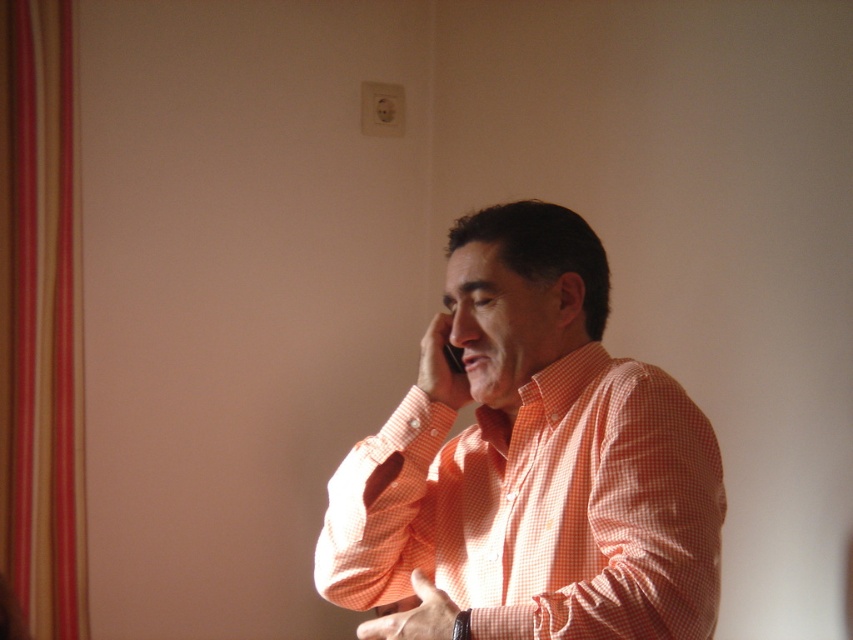
Question: Which point is closer to the camera?

Choices:
 (A) (457, 348)
 (B) (601, 321)
 (C) (49, 262)

Answer: (B)

Question: Is striped fabric curtain at left closer to camera compared to black plastic phone at center?

Choices:
 (A) no
 (B) yes

Answer: (A)

Question: Which object is the closest to the orange checkered shirt at center?

Choices:
 (A) black plastic phone at center
 (B) striped fabric curtain at left

Answer: (A)

Question: Does orange checkered shirt at center appear on the left side of striped fabric curtain at left?

Choices:
 (A) no
 (B) yes

Answer: (A)

Question: Is orange checkered shirt at center smaller than black plastic phone at center?

Choices:
 (A) no
 (B) yes

Answer: (A)

Question: Among these points, which one is farthest from the camera?

Choices:
 (A) (x=625, y=371)
 (B) (x=85, y=572)

Answer: (B)